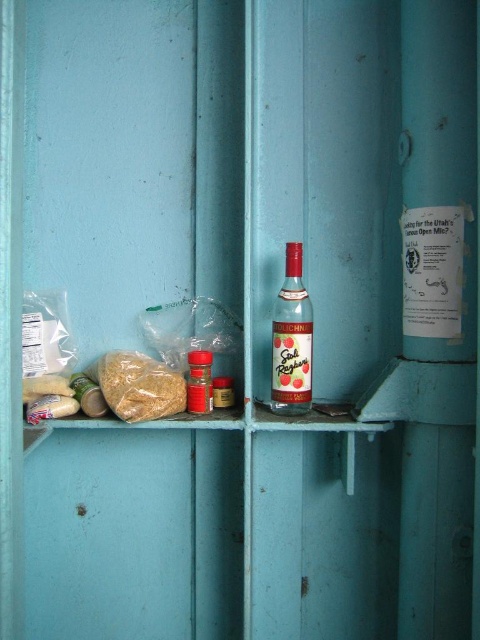
Does point (166, 385) come closer to viewer compared to point (194, 403)?

Yes, point (166, 385) is in front of point (194, 403).

Is brown matte rice at left wider than matte plastic container at center?

Yes.

Which is in front, point (136, 356) or point (192, 381)?

Positioned in front is point (192, 381).

Find the location of a particular element. The height and width of the screenshot is (640, 480). brown matte rice at left is located at coordinates (139, 387).

Does matte glass bottle at center have a lesser width compared to brown matte rice at left?

Yes, matte glass bottle at center is thinner than brown matte rice at left.

Does matte glass bottle at center appear under brown matte rice at left?

Incorrect, matte glass bottle at center is not positioned below brown matte rice at left.

This screenshot has height=640, width=480. What do you see at coordinates (291, 339) in the screenshot?
I see `matte glass bottle at center` at bounding box center [291, 339].

You are a GUI agent. You are given a task and a screenshot of the screen. Output one action in this format:
    pyautogui.click(x=<x>, y=<y>)
    Task: Click on the matte glass bottle at center
    This screenshot has height=640, width=480.
    Given the screenshot: What is the action you would take?
    pyautogui.click(x=291, y=339)

Is matte glass bottle at center below matte plastic container at center?

No, matte glass bottle at center is not below matte plastic container at center.

Is point (273, 394) positioned in front of point (199, 358)?

No, it is not.

Does point (282, 372) come farther from viewer compared to point (191, 349)?

No.

At what (x,y) coordinates should I click in order to perform the action: click on matte glass bottle at center. Please return your answer as a coordinate pair (x, y). The height and width of the screenshot is (640, 480). Looking at the image, I should click on (291, 339).